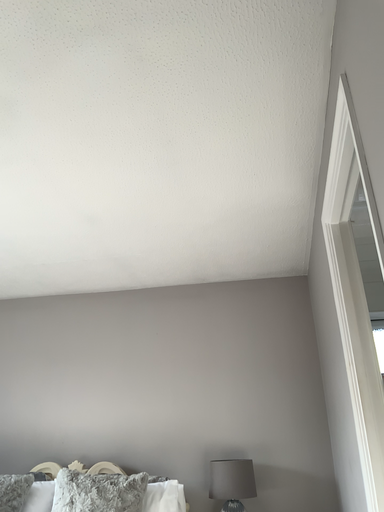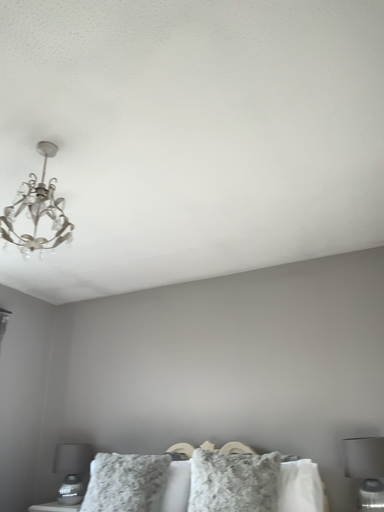
Question: Which way did the camera rotate in the video?

Choices:
 (A) rotated left
 (B) rotated right

Answer: (A)